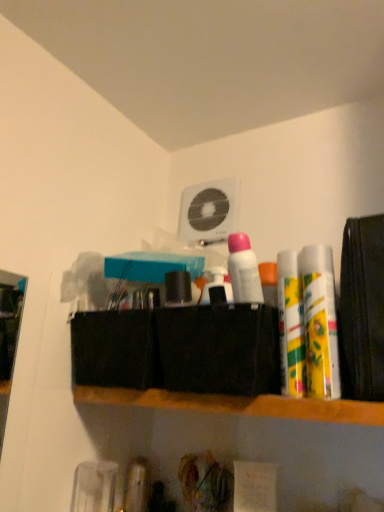
Question: Is yellow matte lip balm at right, which appears as the third toiletry when viewed from the left, smaller than white matte deodorant at center, placed as the 3th toiletry when sorted from right to left?

Choices:
 (A) yes
 (B) no

Answer: (B)

Question: Would you consider yellow matte lip balm at right, which appears as the third toiletry when viewed from the left, to be distant from white matte deodorant at center, acting as the first toiletry starting from the left?

Choices:
 (A) no
 (B) yes

Answer: (A)

Question: Considering the relative sizes of yellow matte lip balm at right, which appears as the third toiletry when viewed from the left, and white matte deodorant at center, acting as the first toiletry starting from the left, in the image provided, is yellow matte lip balm at right, which appears as the third toiletry when viewed from the left, bigger than white matte deodorant at center, acting as the first toiletry starting from the left,?

Choices:
 (A) no
 (B) yes

Answer: (B)

Question: From the image's perspective, would you say yellow matte lip balm at right, the first toiletry when ordered from right to left, is positioned over white matte deodorant at center, acting as the first toiletry starting from the left?

Choices:
 (A) no
 (B) yes

Answer: (A)

Question: Is yellow matte lip balm at right, which appears as the third toiletry when viewed from the left, shorter than white matte deodorant at center, acting as the first toiletry starting from the left?

Choices:
 (A) no
 (B) yes

Answer: (A)

Question: Is yellow matte lip balm at right, which appears as the third toiletry when viewed from the left, wider than white matte deodorant at center, acting as the first toiletry starting from the left?

Choices:
 (A) no
 (B) yes

Answer: (B)

Question: Is yellow-green plastic spray cans at right, the 2th toiletry when ordered from right to left, not near wooden shelf at center?

Choices:
 (A) no
 (B) yes

Answer: (A)

Question: Does yellow-green plastic spray cans at right, marked as the second toiletry in a left-to-right arrangement, have a larger size compared to wooden shelf at center?

Choices:
 (A) yes
 (B) no

Answer: (B)

Question: Could you tell me if yellow-green plastic spray cans at right, the 2th toiletry when ordered from right to left, is turned towards wooden shelf at center?

Choices:
 (A) yes
 (B) no

Answer: (B)

Question: Is yellow-green plastic spray cans at right, marked as the second toiletry in a left-to-right arrangement, to the right of wooden shelf at center from the viewer's perspective?

Choices:
 (A) yes
 (B) no

Answer: (A)

Question: Can we say yellow-green plastic spray cans at right, the 2th toiletry when ordered from right to left, lies outside wooden shelf at center?

Choices:
 (A) yes
 (B) no

Answer: (A)

Question: Is yellow-green plastic spray cans at right, marked as the second toiletry in a left-to-right arrangement, closer to the viewer compared to wooden shelf at center?

Choices:
 (A) yes
 (B) no

Answer: (B)

Question: From a real-world perspective, is white matte deodorant at center, acting as the first toiletry starting from the left, under wooden shelf at center?

Choices:
 (A) no
 (B) yes

Answer: (A)